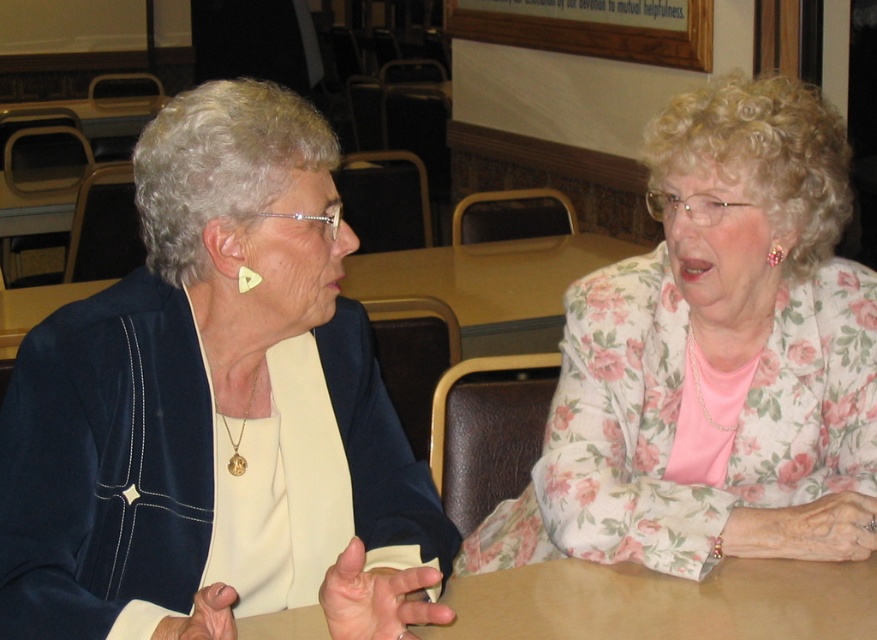
Question: Is floral fabric blouse at center bigger than brown wooden table at center?

Choices:
 (A) no
 (B) yes

Answer: (B)

Question: Can you confirm if matte black jacket at left is wider than floral fabric blouse at center?

Choices:
 (A) no
 (B) yes

Answer: (A)

Question: Among these points, which one is farthest from the camera?

Choices:
 (A) (590, 595)
 (B) (355, 602)
 (C) (831, 228)

Answer: (C)

Question: Which of these objects is positioned farthest from the matte black jacket at left?

Choices:
 (A) brown wooden table at center
 (B) floral fabric blouse at center

Answer: (B)

Question: Which object is farther from the camera taking this photo?

Choices:
 (A) floral fabric blouse at center
 (B) matte black jacket at left
 (C) brown wooden table at center

Answer: (A)

Question: Is floral fabric blouse at center smaller than brown wooden table at center?

Choices:
 (A) no
 (B) yes

Answer: (A)